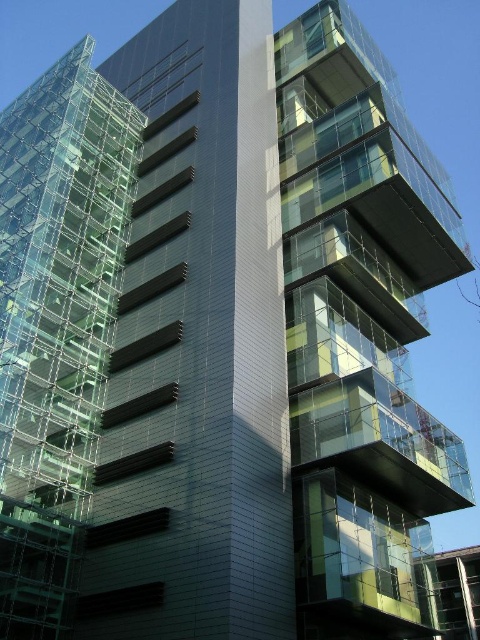
Question: Does transparent glass building at upper right appear on the right side of transparent glass scaffolding at left?

Choices:
 (A) yes
 (B) no

Answer: (A)

Question: Is transparent glass building at upper right below transparent glass scaffolding at left?

Choices:
 (A) yes
 (B) no

Answer: (B)

Question: Is transparent glass building at upper right bigger than transparent glass scaffolding at left?

Choices:
 (A) no
 (B) yes

Answer: (B)

Question: Which object is closer to the camera taking this photo?

Choices:
 (A) transparent glass scaffolding at left
 (B) transparent glass building at upper right

Answer: (B)

Question: Which point is closer to the camera taking this photo?

Choices:
 (A) (24, 113)
 (B) (315, 284)

Answer: (B)

Question: Which of the following is the farthest from the observer?

Choices:
 (A) (62, 634)
 (B) (357, 88)

Answer: (B)